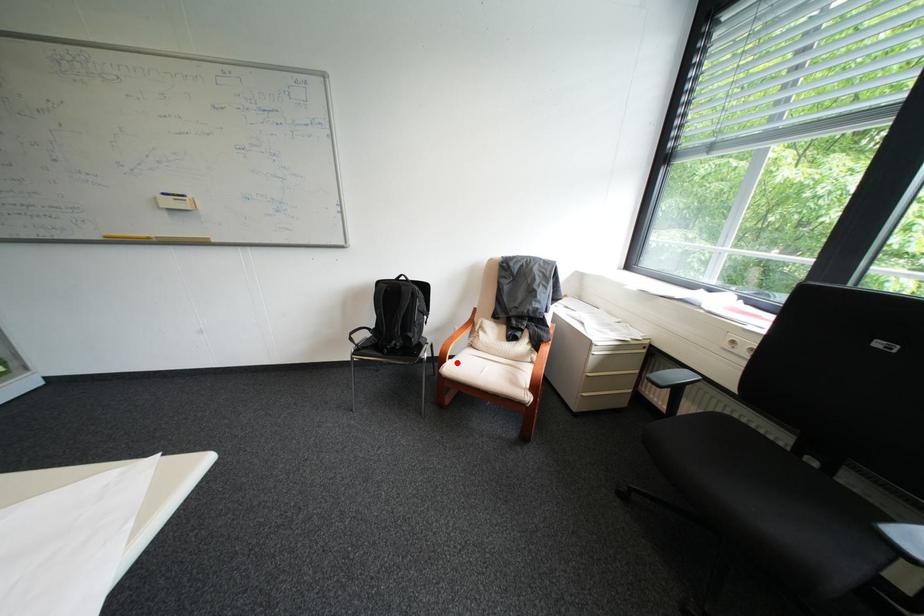
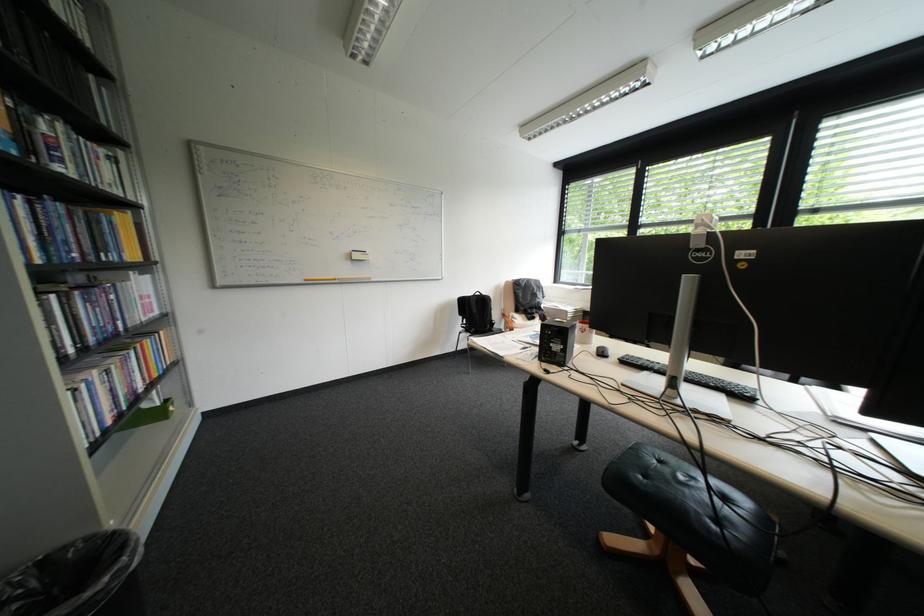
Question: I am providing you with two images of the same scene from different viewpoints. A red point is marked on the first image. At the location where the point appears in image 1, is it still visible in image 2?

Choices:
 (A) Yes
 (B) No

Answer: (B)